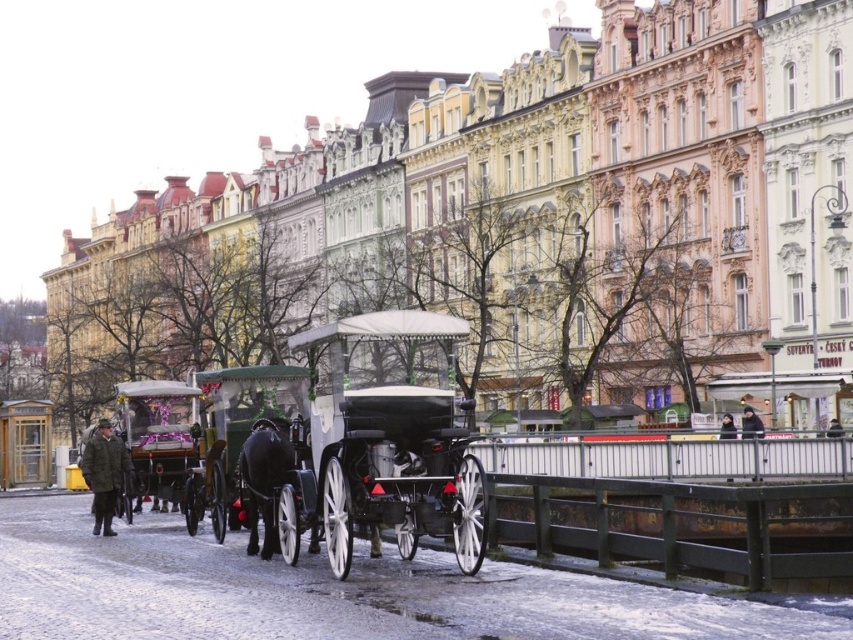
You are a tourist standing on the cobblestone street and want to take a photo of both the dark green wool coat at left and the dark brown leather jacket at center. Given that your camera has a maximum zoom range of 30 meters, will you be able to capture both subjects in a single photo without moving?

The distance between the dark green wool coat at left and the dark brown leather jacket at center is 35.59 meters, which exceeds the camera maximum zoom range of 30 meters. Therefore, you won

You are standing at the entrance of the street and want to find the dark gray jacket at center. According to the coordinates provided, in which direction should you look to locate it?

The dark gray jacket at center is located at coordinates point (751, 422). Since the coordinate system is not specified, but typically in such contexts, the first number represents the horizontal axis and the second the vertical. Assuming the origin is at the bottom left corner, 0.662 on the x axis would be to the right of center, and 0.882 on the y axis would be near the bottom. Therefore, you should look to the lower right of the image to find the dark gray jacket at center.